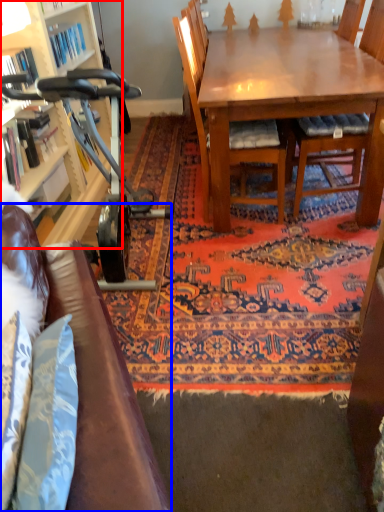
Question: Which point is further to the camera, cabinetry (highlighted by a red box) or studio couch (highlighted by a blue box)?

Choices:
 (A) cabinetry
 (B) studio couch

Answer: (A)